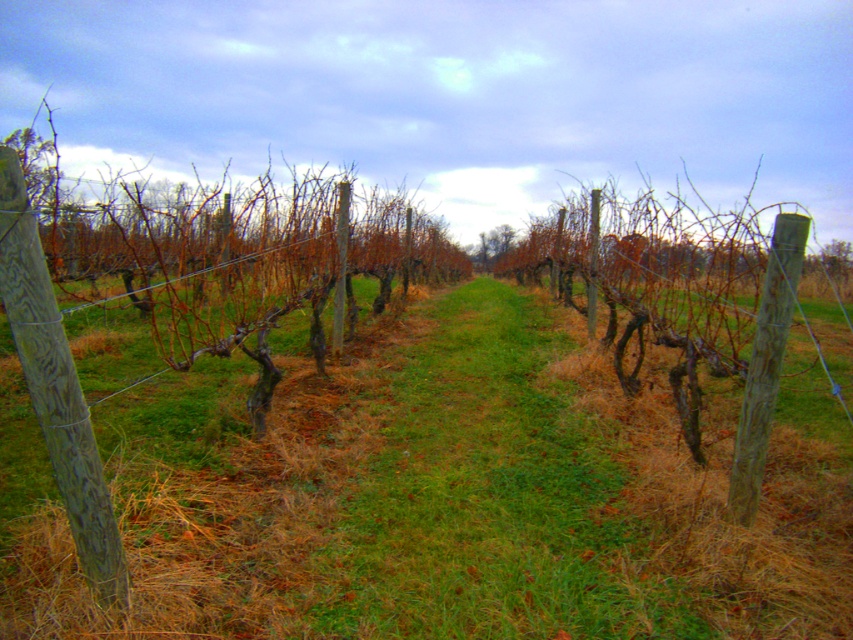
Question: Which of the following is the farthest from the observer?

Choices:
 (A) (775, 572)
 (B) (190, 541)

Answer: (B)

Question: Can you confirm if green grass at center is positioned to the left of wooden post at left?

Choices:
 (A) no
 (B) yes

Answer: (A)

Question: In this image, where is green grass at center located relative to wooden post at left?

Choices:
 (A) below
 (B) above

Answer: (A)

Question: Does green grass at center appear over wooden post at left?

Choices:
 (A) no
 (B) yes

Answer: (A)

Question: Which point is closer to the camera taking this photo?

Choices:
 (A) (781, 444)
 (B) (55, 337)

Answer: (B)